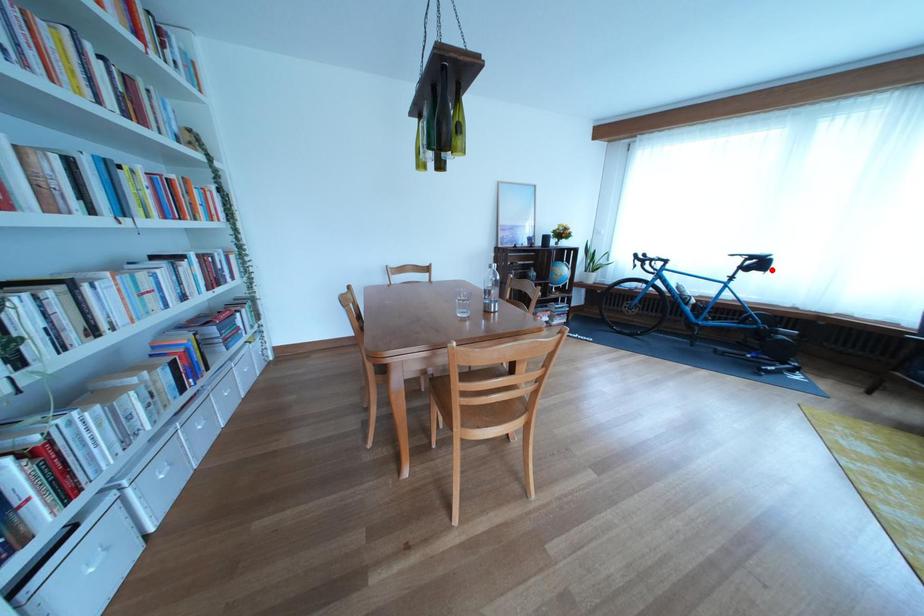
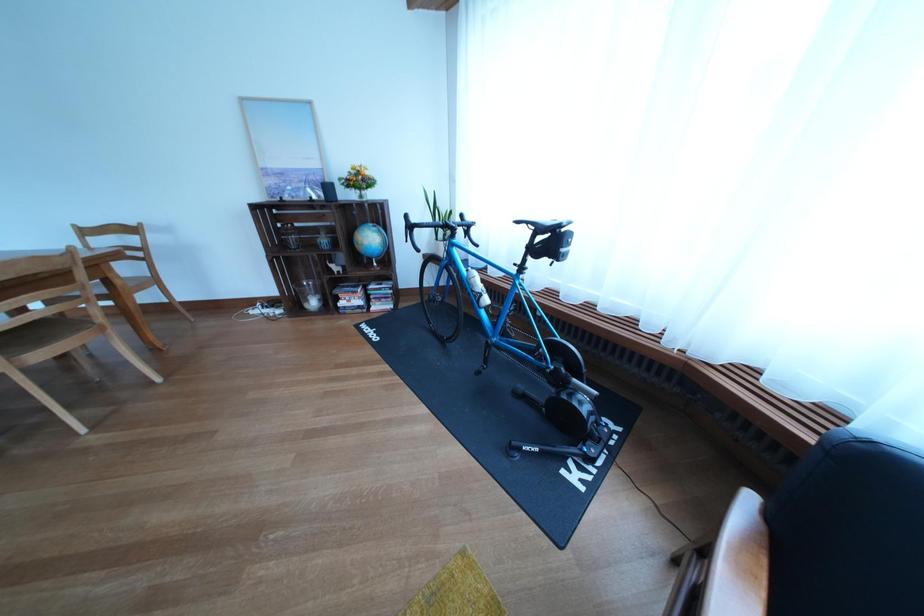
Question: I am providing you with two images of the same scene from different viewpoints. A red point is shown in image1. For the corresponding object point in image2, is it positioned nearer or farther from the camera?

Choices:
 (A) Nearer
 (B) Farther

Answer: (A)